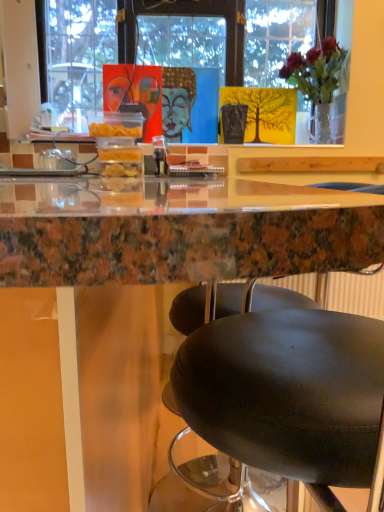
Question: From a real-world perspective, is marble table at center physically located above or below translucent glass vase at upper right?

Choices:
 (A) below
 (B) above

Answer: (A)

Question: Choose the correct answer: Is marble table at center inside translucent glass vase at upper right or outside it?

Choices:
 (A) outside
 (B) inside

Answer: (A)

Question: Is point (18, 364) closer or farther from the camera than point (329, 37)?

Choices:
 (A) farther
 (B) closer

Answer: (B)

Question: Based on their sizes in the image, would you say translucent glass vase at upper right is bigger or smaller than marble table at center?

Choices:
 (A) big
 (B) small

Answer: (B)

Question: Do you think translucent glass vase at upper right is within marble table at center, or outside of it?

Choices:
 (A) outside
 (B) inside

Answer: (A)

Question: From the image's perspective, is translucent glass vase at upper right above or below marble table at center?

Choices:
 (A) below
 (B) above

Answer: (B)

Question: Considering the positions of translucent glass vase at upper right and marble table at center in the image, is translucent glass vase at upper right taller or shorter than marble table at center?

Choices:
 (A) short
 (B) tall

Answer: (A)